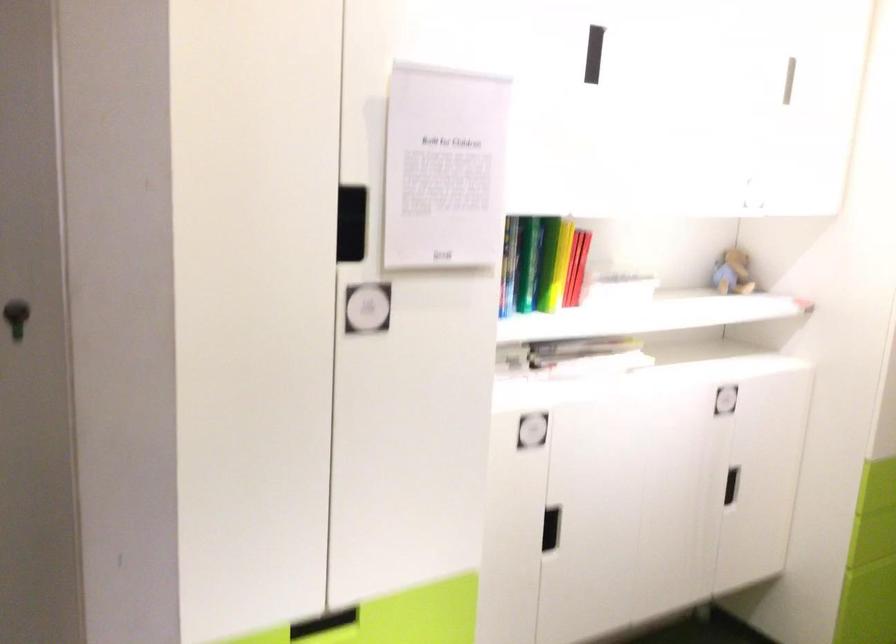
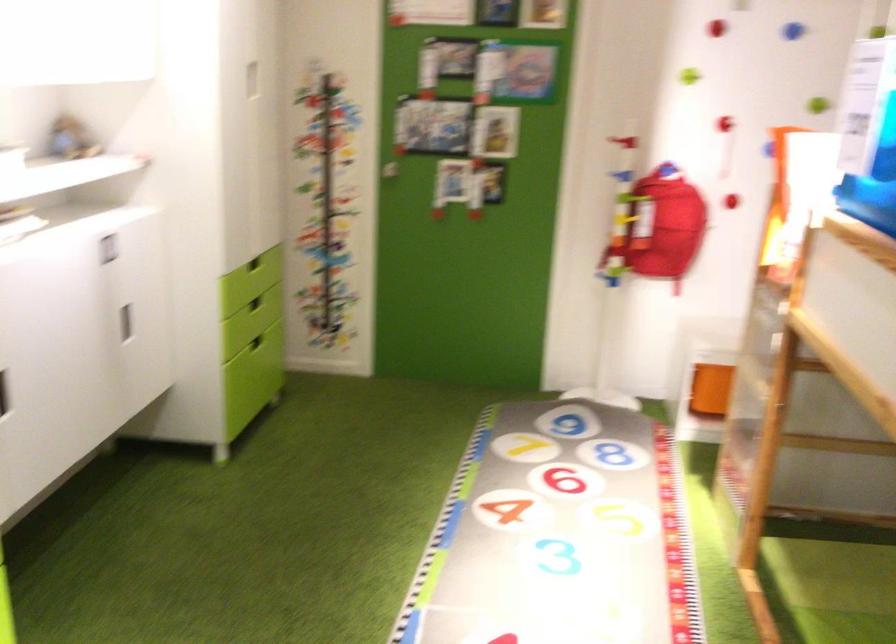
Find the pixel in the second image that matches [518,527] in the first image.

(3, 393)